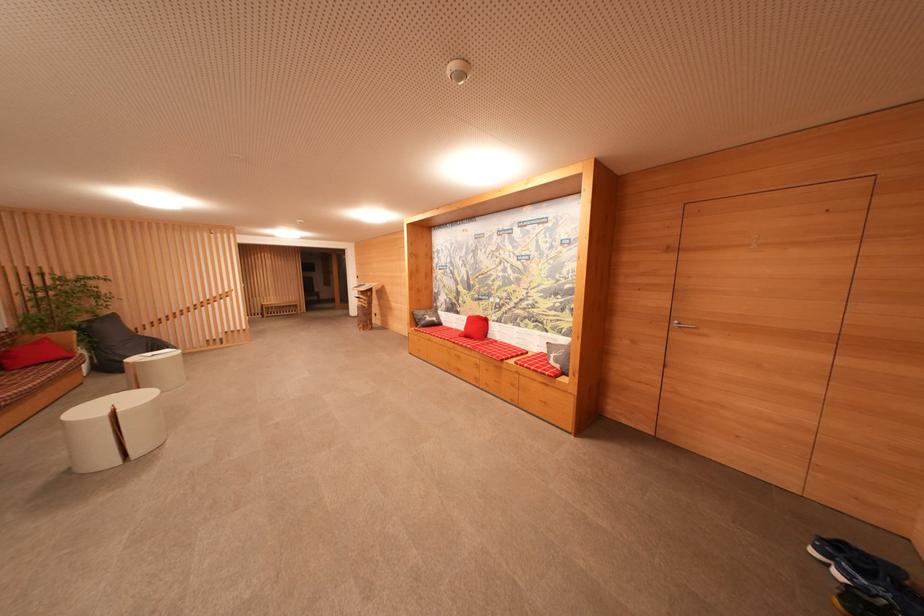
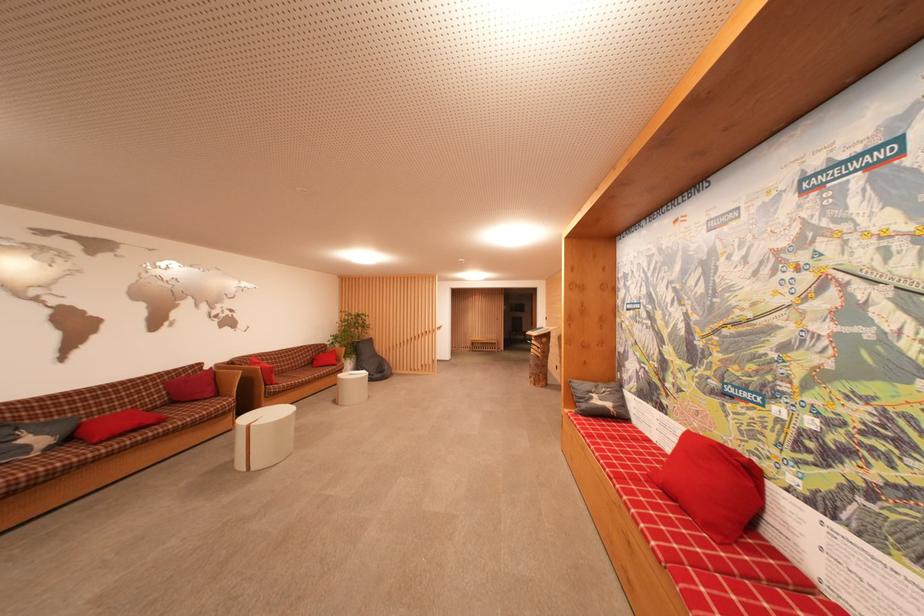
The point at [432,322] is marked in the first image. Where is the corresponding point in the second image?

(601, 405)